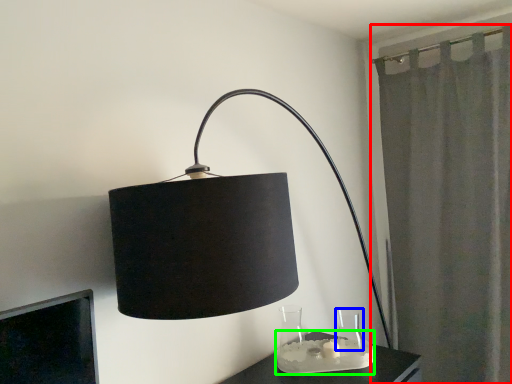
Question: Based on their relative distances, which object is nearer to curtain (highlighted by a red box)? Choose from glass vase (highlighted by a blue box) and candle holder (highlighted by a green box).

Choices:
 (A) glass vase
 (B) candle holder

Answer: (A)